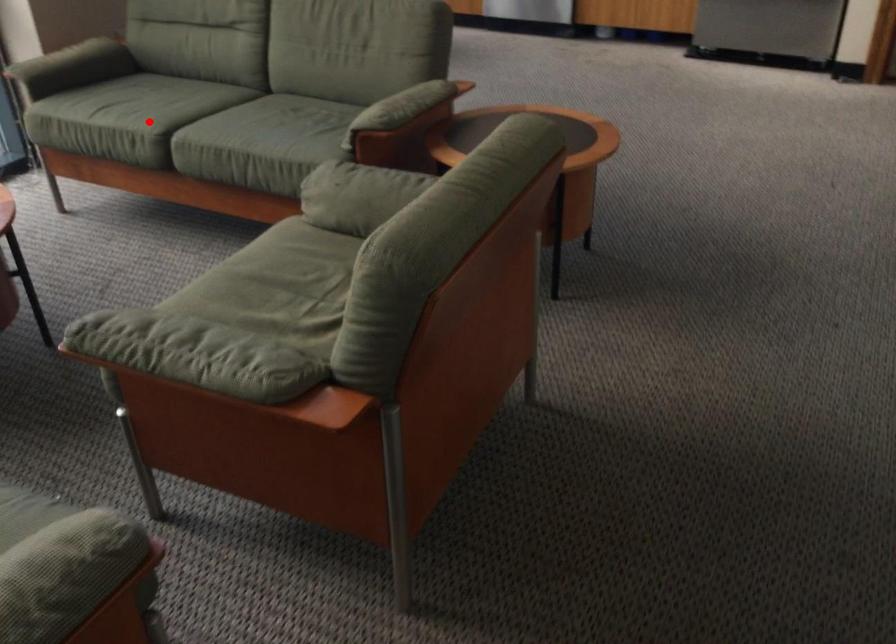
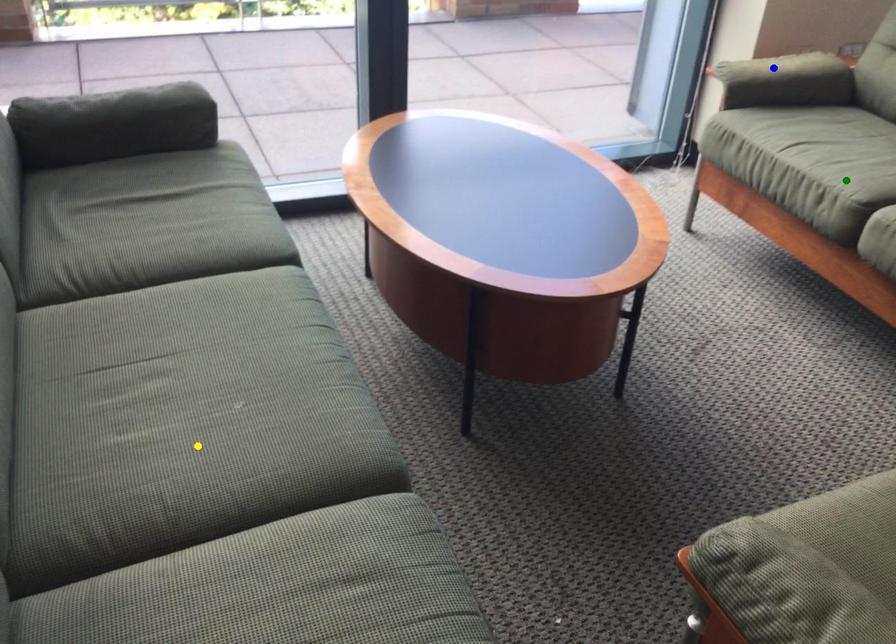
Question: I am providing you with two images of the same scene from different viewpoints. A red point is marked on the first image. You are given multiple points on the second image. Which point in image 2 represents the same 3d spot as the red point in image 1?

Choices:
 (A) yellow point
 (B) blue point
 (C) green point

Answer: (C)